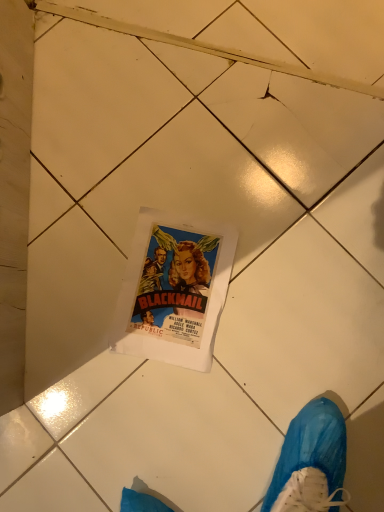
What do you see at coordinates (174, 289) in the screenshot? I see `matte paper poster at center` at bounding box center [174, 289].

Find the location of `matte paper poster at center`. matte paper poster at center is located at coordinates (174, 289).

Find the location of a particular element. matte paper poster at center is located at coordinates (174, 289).